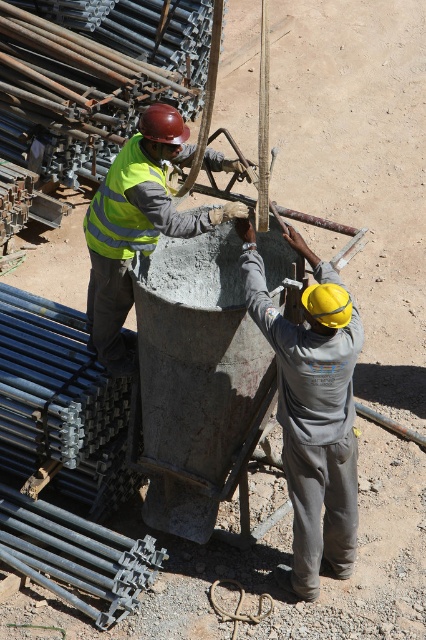
Between gray matte concrete at center and reflective yellow safety vest at center, which one has more height?

Standing taller between the two is gray matte concrete at center.

Who is shorter, gray matte concrete at center or reflective yellow safety vest at center?

With less height is reflective yellow safety vest at center.

Locate an element on the screen. Image resolution: width=426 pixels, height=640 pixels. gray matte concrete at center is located at coordinates (313, 412).

Where is `gray matte concrete at center`? gray matte concrete at center is located at coordinates (313, 412).

Can you confirm if reflective yellow vest at center is bigger than reflective yellow safety vest at center?

Indeed, reflective yellow vest at center has a larger size compared to reflective yellow safety vest at center.

Image resolution: width=426 pixels, height=640 pixels. I want to click on reflective yellow vest at center, so click(135, 225).

This screenshot has height=640, width=426. What do you see at coordinates (135, 225) in the screenshot? I see `reflective yellow vest at center` at bounding box center [135, 225].

This screenshot has width=426, height=640. I want to click on reflective yellow vest at center, so click(135, 225).

Between gray matte concrete at center and reflective yellow vest at center, which one appears on the left side from the viewer's perspective?

From the viewer's perspective, reflective yellow vest at center appears more on the left side.

Between gray matte concrete at center and reflective yellow vest at center, which one is positioned higher?

reflective yellow vest at center is above.

The width and height of the screenshot is (426, 640). Find the location of `gray matte concrete at center`. gray matte concrete at center is located at coordinates (313, 412).